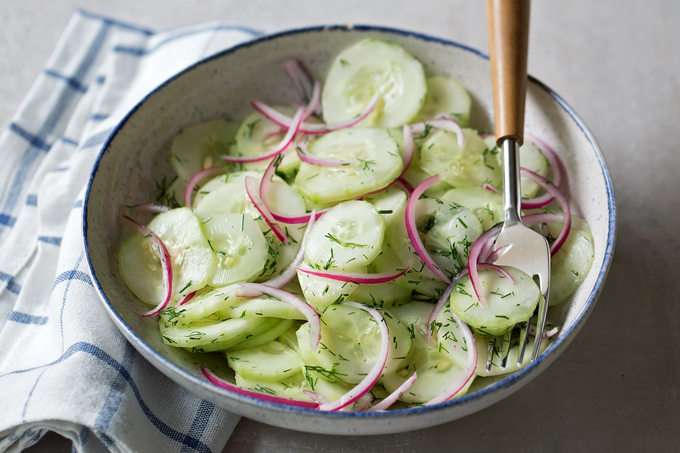
The image size is (680, 453). In order to click on napkin in this screenshot , I will do coord(66,370).